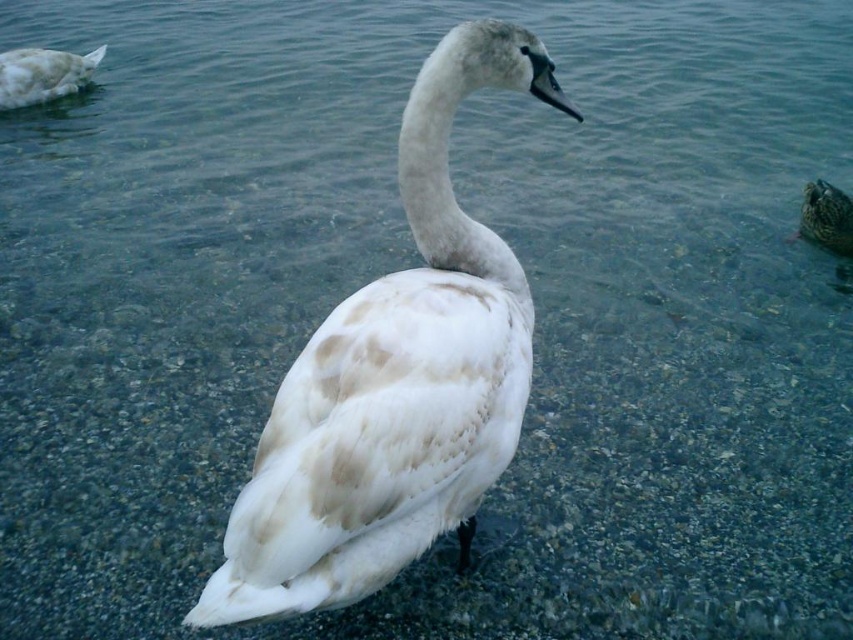
Question: Considering the real-world distances, which object is farthest from the speckled brown duck at right?

Choices:
 (A) white fluffy duck at upper left
 (B) white fluffy swan at center

Answer: (A)

Question: Does white fluffy duck at upper left lie behind speckled brown duck at right?

Choices:
 (A) yes
 (B) no

Answer: (A)

Question: Which object is the closest to the white fluffy duck at upper left?

Choices:
 (A) white fluffy swan at center
 (B) speckled brown duck at right

Answer: (A)

Question: Is white fluffy swan at center to the right of white fluffy duck at upper left from the viewer's perspective?

Choices:
 (A) yes
 (B) no

Answer: (A)

Question: Which point is farther to the camera?

Choices:
 (A) (256, 486)
 (B) (839, 220)

Answer: (B)

Question: Is white fluffy duck at upper left closer to the viewer compared to speckled brown duck at right?

Choices:
 (A) no
 (B) yes

Answer: (A)